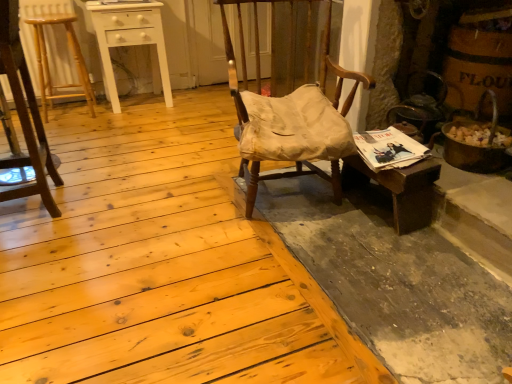
Locate an element on the screen. vacant space in wooden desk at right (from a real-world perspective) is located at coordinates (372, 205).